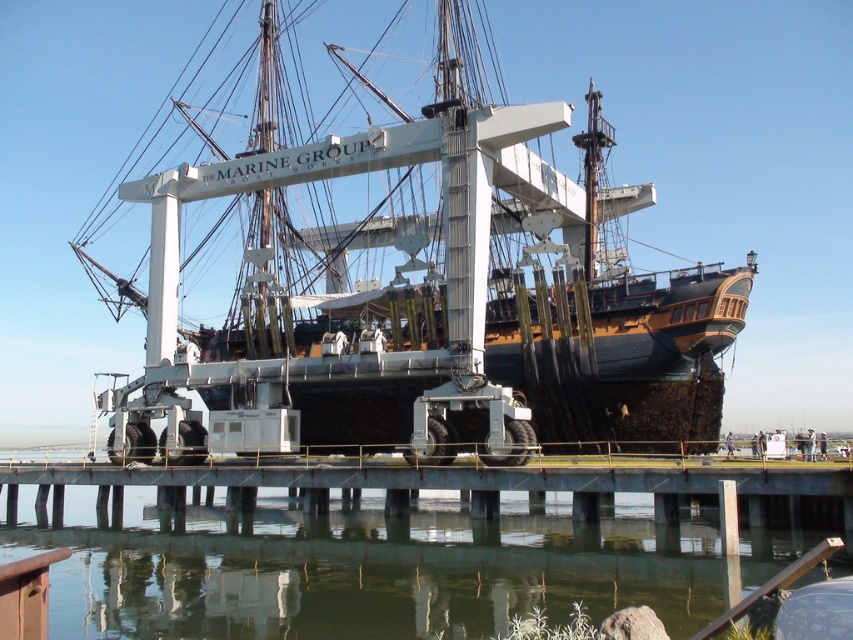
You are standing at the point with coordinates (425,296) on the image. What object is located exactly at that point?

The wooden pirate ship at center is located exactly at point (425,296).

You are standing on the crane platform observing the wooden pirate ship at center and the greenish water at lower center. Which object is closer to you?

The wooden pirate ship at center is closer to you because it is further to the viewer than the greenish water at lower center.